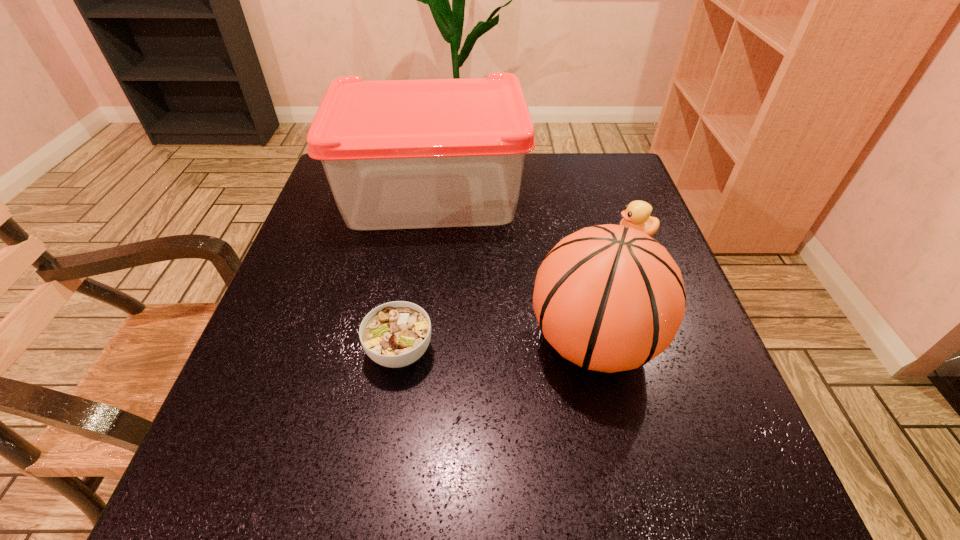
At what (x,y) coordinates should I click in order to perform the action: click on object that is at the far edge. Please return your answer as a coordinate pair (x, y). Looking at the image, I should click on (398, 154).

The width and height of the screenshot is (960, 540). I want to click on object that is at the left edge, so click(398, 154).

Where is `basketball situated at the right edge`? basketball situated at the right edge is located at coordinates (609, 298).

Image resolution: width=960 pixels, height=540 pixels. What are the coordinates of `duckling located in the right edge section of the desktop` in the screenshot? It's located at (636, 215).

Image resolution: width=960 pixels, height=540 pixels. Find the location of `object situated at the far left corner`. object situated at the far left corner is located at coordinates (398, 154).

Locate an element on the screen. The height and width of the screenshot is (540, 960). free region at the far edge is located at coordinates (544, 154).

Identify the location of blank area at the near edge. This screenshot has height=540, width=960. (424, 467).

At what (x,y) coordinates should I click in order to perform the action: click on free space at the left edge. Please return your answer as a coordinate pair (x, y). This screenshot has height=540, width=960. Looking at the image, I should click on (279, 344).

The width and height of the screenshot is (960, 540). Find the location of `free region at the right edge of the desktop`. free region at the right edge of the desktop is located at coordinates (729, 445).

The width and height of the screenshot is (960, 540). In order to click on vacant space at the far right corner in this screenshot , I will do `click(607, 193)`.